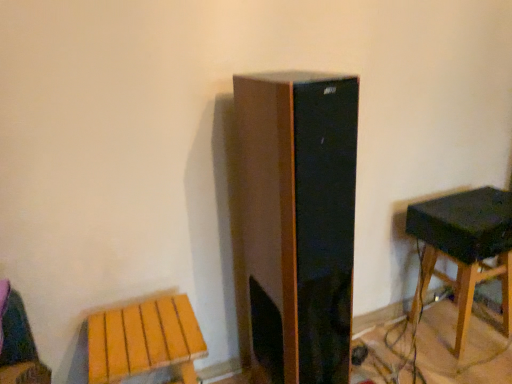
The height and width of the screenshot is (384, 512). What do you see at coordinates (144, 340) in the screenshot? I see `wooden stool at lower left, which is the second stool in back-to-front order` at bounding box center [144, 340].

The width and height of the screenshot is (512, 384). In order to click on wooden stool at right, the 1th stool from the back in this screenshot , I will do `click(465, 248)`.

Can you confirm if wooden stool at right, which ranks as the 1th stool in right-to-left order, is shorter than wooden stool at lower left, which is counted as the 1th stool, starting from the left?

No, wooden stool at right, which ranks as the 1th stool in right-to-left order, is not shorter than wooden stool at lower left, which is counted as the 1th stool, starting from the left.

Locate an element on the screen. The height and width of the screenshot is (384, 512). stool above the wooden stool at lower left, which is counted as the 1th stool, starting from the left (from the image's perspective) is located at coordinates (465, 248).

What's the angular difference between wooden stool at right, which ranks as the 1th stool in right-to-left order, and wooden stool at lower left, which is the second stool in back-to-front order,'s facing directions?

The facing directions of wooden stool at right, which ranks as the 1th stool in right-to-left order, and wooden stool at lower left, which is the second stool in back-to-front order, are 5.84 degrees apart.

Can you confirm if wooden stool at right, which ranks as the 1th stool in right-to-left order, is smaller than wooden stool at lower left, the 2th stool in the right-to-left sequence?

Indeed, wooden stool at right, which ranks as the 1th stool in right-to-left order, has a smaller size compared to wooden stool at lower left, the 2th stool in the right-to-left sequence.

Is point (504, 238) less distant than point (445, 233)?

Yes, it is.

Which object is thinner, black matte speaker at right or wooden stool at right, the second stool positioned from the front?

Thinner between the two is wooden stool at right, the second stool positioned from the front.

In the scene shown: Is black matte speaker at right not inside wooden stool at right, the 1th stool from the back?

Indeed, black matte speaker at right is completely outside wooden stool at right, the 1th stool from the back.

In the image, there is a wooden stool at right, which ranks as the 1th stool in right-to-left order. At what (x,y) coordinates should I click in order to perform the action: click on speaker above it (from the image's perspective). Please return your answer as a coordinate pair (x, y). The image size is (512, 384). Looking at the image, I should click on (464, 223).

From a real-world perspective, which object stands above the other?

Answer: black matte speaker at right.

Identify the location of speaker above the wooden stool at lower left, which is the second stool in back-to-front order (from a real-world perspective). (464, 223).

Which object is more forward, wooden stool at lower left, the first stool in the front-to-back sequence, or black matte speaker at right?

wooden stool at lower left, the first stool in the front-to-back sequence, is more forward.

Which object is positioned more to the right, wooden stool at lower left, which is counted as the 1th stool, starting from the left, or black matte speaker at right?

From the viewer's perspective, black matte speaker at right appears more on the right side.

Which of these two, wooden stool at lower left, which is the second stool in back-to-front order, or wooden stool at right, which ranks as the 1th stool in right-to-left order, is bigger?

With larger size is wooden stool at lower left, which is the second stool in back-to-front order.

Based on the photo, from the image's perspective, is wooden stool at lower left, which is the second stool in back-to-front order, beneath wooden stool at right, the 1th stool from the back?

Correct, wooden stool at lower left, which is the second stool in back-to-front order, appears lower than wooden stool at right, the 1th stool from the back, in the image.

Is wooden stool at lower left, the first stool in the front-to-back sequence, shorter than wooden stool at right, which ranks as the 1th stool in right-to-left order?

Yes.

Does point (117, 349) come closer to viewer compared to point (478, 245)?

Yes, it is.

Could you tell me if wooden stool at right, the 2th stool when ordered from left to right, is facing black matte speaker at right?

No, wooden stool at right, the 2th stool when ordered from left to right, is not facing towards black matte speaker at right.

Can you confirm if wooden stool at right, the 1th stool from the back, is positioned to the right of black matte speaker at right?

In fact, wooden stool at right, the 1th stool from the back, is to the left of black matte speaker at right.

Is wooden stool at right, the 2th stool when ordered from left to right, inside the boundaries of black matte speaker at right, or outside?

wooden stool at right, the 2th stool when ordered from left to right, is spatially situated outside black matte speaker at right.

Is there a large distance between wooden stool at right, which ranks as the 1th stool in right-to-left order, and black matte speaker at right?

No, wooden stool at right, which ranks as the 1th stool in right-to-left order, is not far from black matte speaker at right.

From a real-world perspective, is black matte speaker at right under wooden stool at lower left, which is counted as the 1th stool, starting from the left?

No, from a real-world perspective, black matte speaker at right is not under wooden stool at lower left, which is counted as the 1th stool, starting from the left.

In the scene shown: Which is correct: black matte speaker at right is inside wooden stool at lower left, the first stool in the front-to-back sequence, or outside of it?

black matte speaker at right is located beyond the bounds of wooden stool at lower left, the first stool in the front-to-back sequence.

Does black matte speaker at right come behind wooden stool at lower left, which is the second stool in back-to-front order?

Yes, it is.

Would you say black matte speaker at right is a long distance from wooden stool at lower left, which is counted as the 1th stool, starting from the left?

That's right, there is a large distance between black matte speaker at right and wooden stool at lower left, which is counted as the 1th stool, starting from the left.

You are a GUI agent. You are given a task and a screenshot of the screen. Output one action in this format:
    pyautogui.click(x=<x>, y=<y>)
    Task: Click on the stool located on the right of wooden stool at lower left, which is the second stool in back-to-front order
    
    Given the screenshot: What is the action you would take?
    pyautogui.click(x=465, y=248)

From a real-world perspective, count 2nd stools downward from the black matte speaker at right and point to it. Please provide its 2D coordinates.

[(465, 248)]

Consider the image. Which object lies nearer to the anchor point wooden stool at lower left, which is counted as the 1th stool, starting from the left, wooden stool at right, the second stool positioned from the front, or black matte speaker at right?

black matte speaker at right.

Considering their positions, is wooden stool at lower left, the 2th stool in the right-to-left sequence, positioned closer to black matte speaker at right than wooden stool at right, the 1th stool from the back?

wooden stool at right, the 1th stool from the back, is positioned closer to the anchor black matte speaker at right.

Estimate the real-world distances between objects in this image. Which object is further from wooden stool at right, which ranks as the 1th stool in right-to-left order, black matte speaker at right or wooden stool at lower left, the first stool in the front-to-back sequence?

wooden stool at lower left, the first stool in the front-to-back sequence.

Considering their positions, is black matte speaker at right positioned closer to wooden stool at lower left, the 2th stool in the right-to-left sequence, than wooden stool at right, the 1th stool from the back?

The object closer to wooden stool at lower left, the 2th stool in the right-to-left sequence, is black matte speaker at right.

From the picture: Looking at the image, which one is located closer to wooden stool at right, the second stool positioned from the front, wooden stool at lower left, the first stool in the front-to-back sequence, or black matte speaker at right?

Based on the image, black matte speaker at right appears to be nearer to wooden stool at right, the second stool positioned from the front.

Looking at this image, based on their spatial positions, is wooden stool at right, the 2th stool when ordered from left to right, or wooden stool at lower left, the 2th stool in the right-to-left sequence, further from black matte speaker at right?

wooden stool at lower left, the 2th stool in the right-to-left sequence, lies further to black matte speaker at right than the other object.

Where is `stool situated between wooden stool at lower left, the 2th stool in the right-to-left sequence, and black matte speaker at right from left to right`? Image resolution: width=512 pixels, height=384 pixels. stool situated between wooden stool at lower left, the 2th stool in the right-to-left sequence, and black matte speaker at right from left to right is located at coordinates (465, 248).